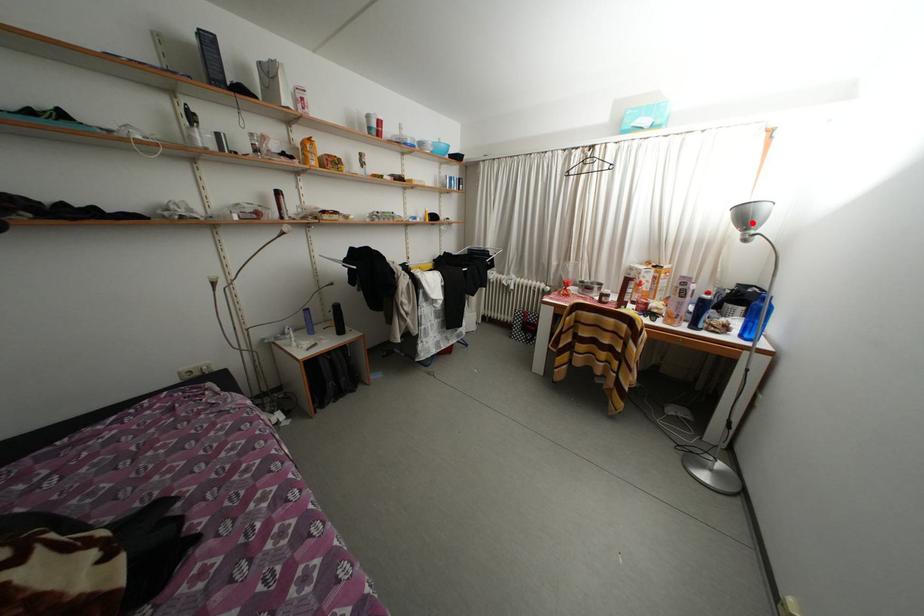
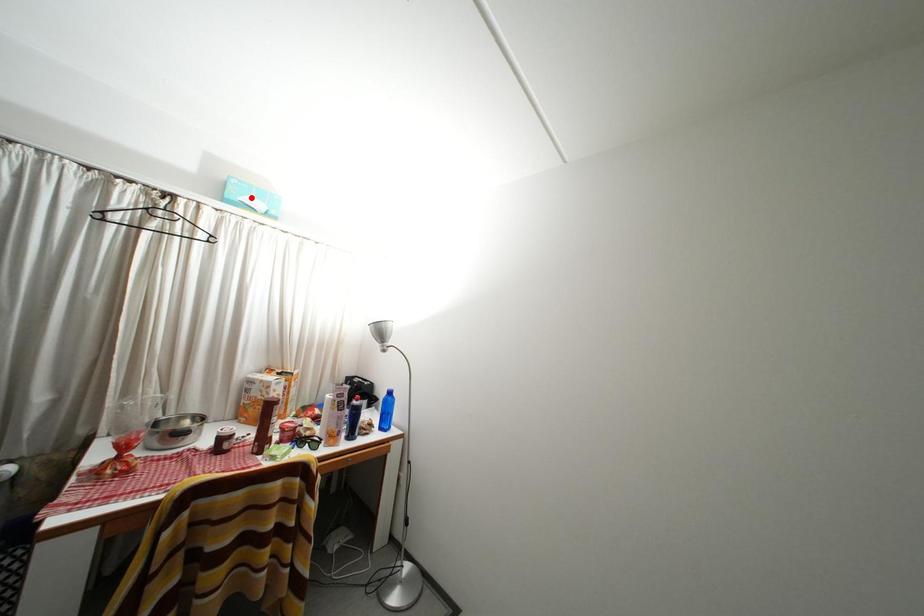
I am providing you with two images of the same scene from different viewpoints. A red point is marked on the first image and another point is marked on the second image. Is the red point in image1 aligned with the point shown in image2?

A: No